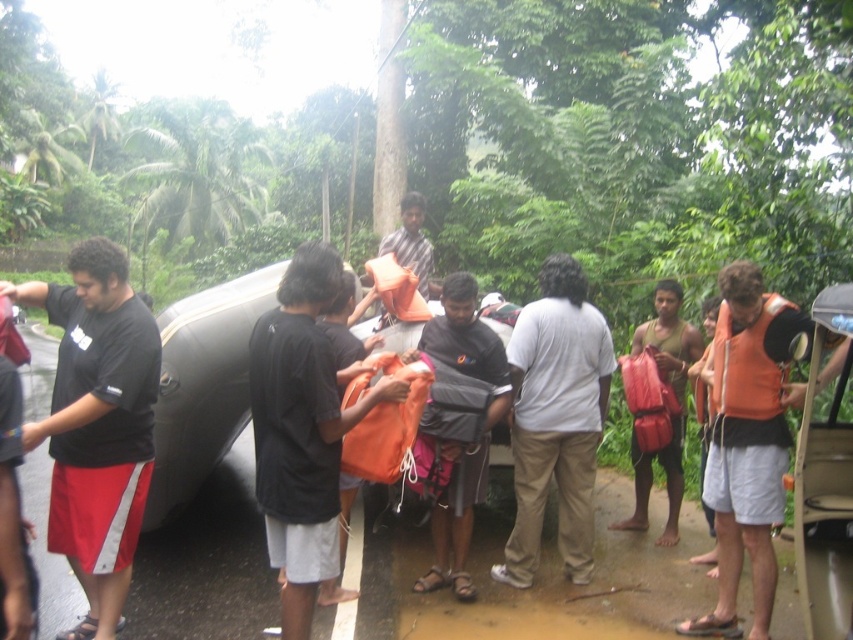
Can you confirm if black fabric shirt at left is shorter than orange fabric bag at center?

No, black fabric shirt at left is not shorter than orange fabric bag at center.

The image size is (853, 640). What do you see at coordinates (97, 422) in the screenshot? I see `black fabric shirt at left` at bounding box center [97, 422].

Is point (68, 298) closer to camera compared to point (260, 436)?

No, (68, 298) is further to viewer.

Where is `black fabric shirt at left`? This screenshot has height=640, width=853. black fabric shirt at left is located at coordinates [x=97, y=422].

In order to click on black fabric shirt at left in this screenshot , I will do `click(97, 422)`.

Which of these two, black fabric shirt at left or dark gray fabric bag at center, stands taller?

With more height is black fabric shirt at left.

Which is behind, point (112, 470) or point (427, 570)?

Positioned behind is point (427, 570).

The height and width of the screenshot is (640, 853). Find the location of `black fabric shirt at left`. black fabric shirt at left is located at coordinates tap(97, 422).

Is orange fabric bag at center smaller than white matte shirt at center?

No, orange fabric bag at center is not smaller than white matte shirt at center.

Which is behind, point (251, 412) or point (517, 540)?

Positioned behind is point (517, 540).

You are a GUI agent. You are given a task and a screenshot of the screen. Output one action in this format:
    pyautogui.click(x=<x>, y=<y>)
    Task: Click on the orange fabric bag at center
    
    Given the screenshot: What is the action you would take?
    pyautogui.click(x=302, y=429)